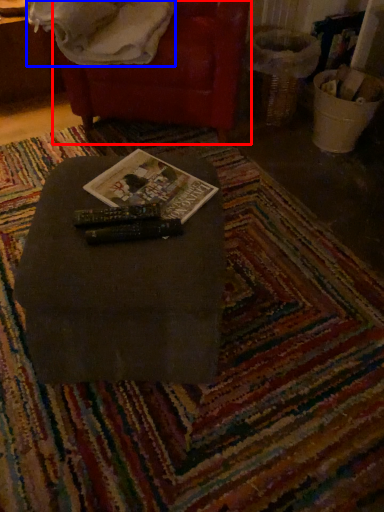
Question: Which point is closer to the camera, bean bag chair (highlighted by a red box) or blanket (highlighted by a blue box)?

Choices:
 (A) bean bag chair
 (B) blanket

Answer: (B)